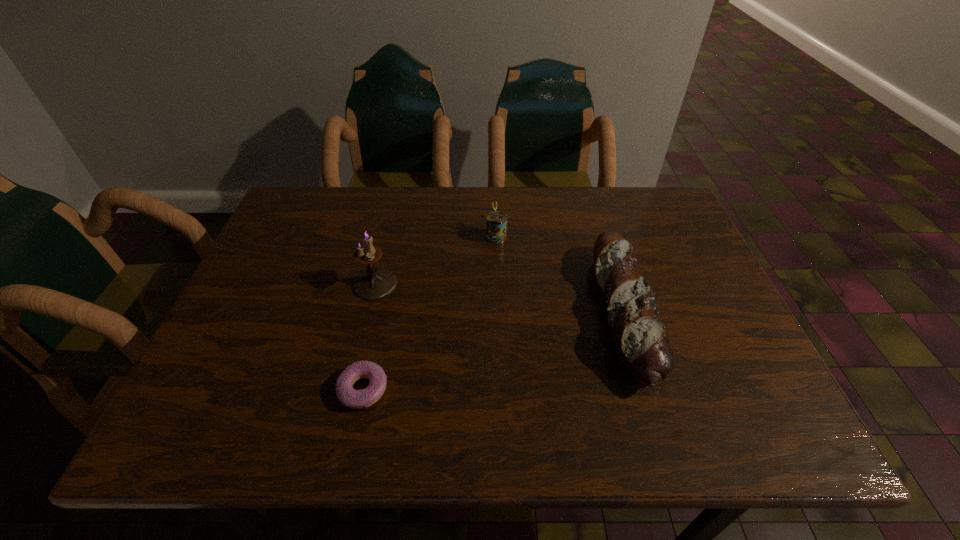
What are the coordinates of `candle holder` in the screenshot? It's located at (374, 283).

Where is `can`? can is located at coordinates (496, 221).

Identify the location of the farthest object. The image size is (960, 540). (496, 221).

You are a GUI agent. You are given a task and a screenshot of the screen. Output one action in this format:
    pyautogui.click(x=<x>, y=<y>)
    Task: Click on the rightmost object
    
    Given the screenshot: What is the action you would take?
    pyautogui.click(x=642, y=341)

Locate an element on the screen. This screenshot has height=540, width=960. the shortest object is located at coordinates (355, 399).

Find the location of a particular element. This screenshot has height=540, width=960. free space located 0.340m on the front of the tallest object is located at coordinates (338, 439).

Locate an element on the screen. The width and height of the screenshot is (960, 540). free space located 0.100m on the right of the farthest object is located at coordinates (546, 236).

At what (x,y) coordinates should I click in order to perform the action: click on free space located 0.210m on the left of the baguet. Please return your answer as a coordinate pair (x, y). Looking at the image, I should click on (507, 313).

Identify the location of free space located on the back of the doughnut. (385, 287).

Find the location of a particular element. object located in the far edge section of the desktop is located at coordinates (496, 221).